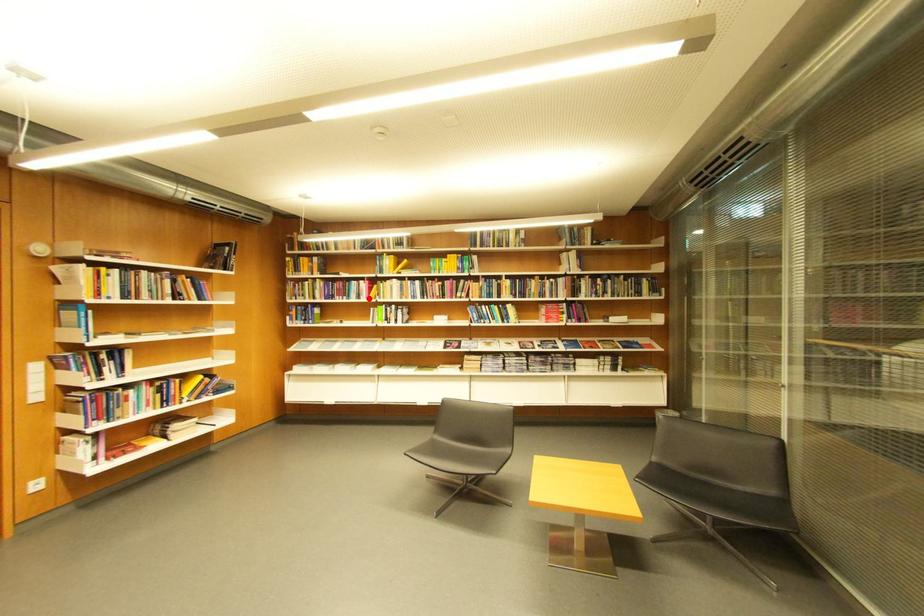
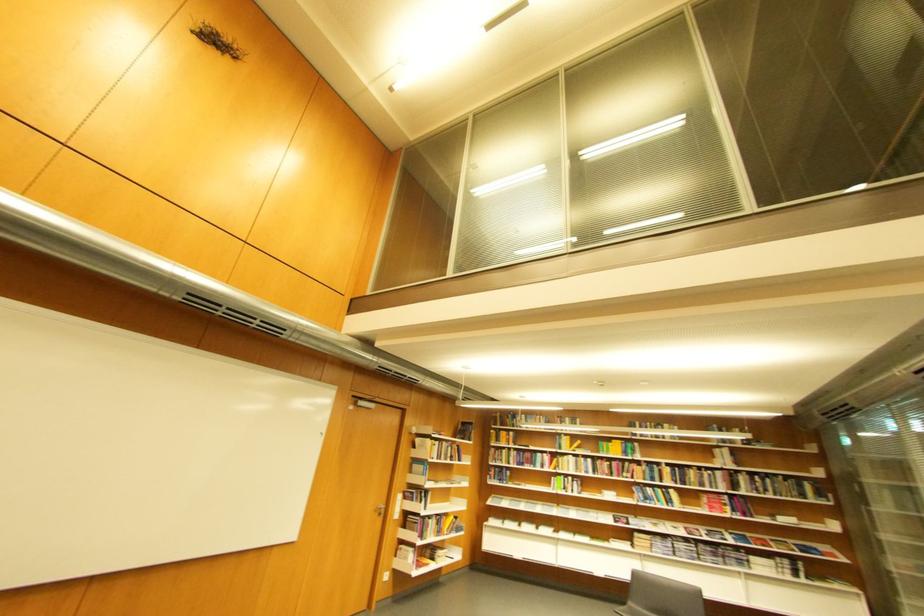
Where in the second image is the point corresponding to the highlighted location from the first image?

(553, 468)